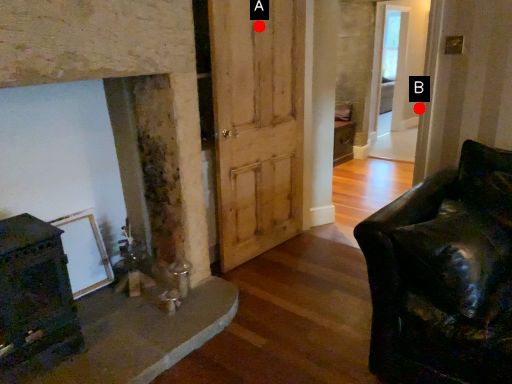
Question: Two points are circled on the image, labeled by A and B beside each circle. Which point is closer to the camera?

Choices:
 (A) A is closer
 (B) B is closer

Answer: (A)